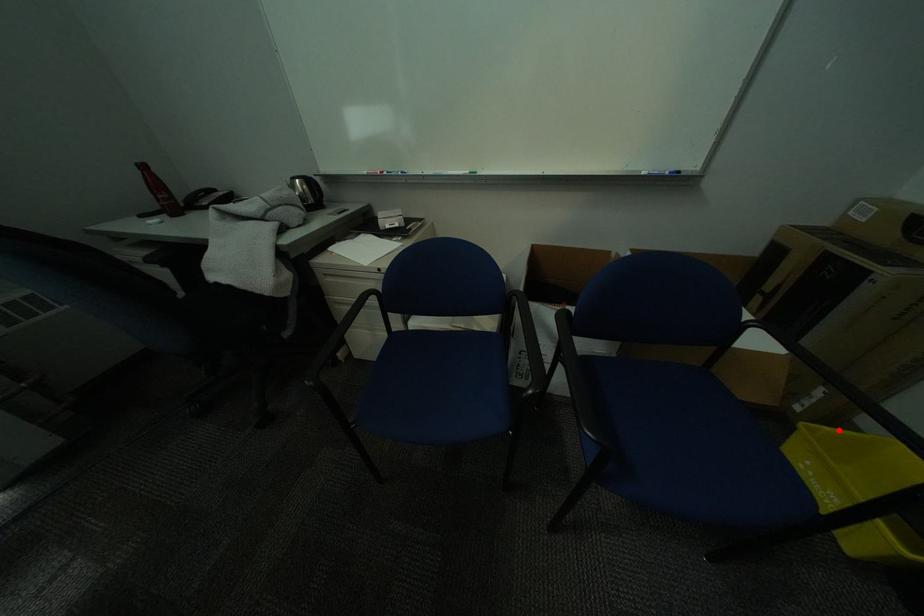
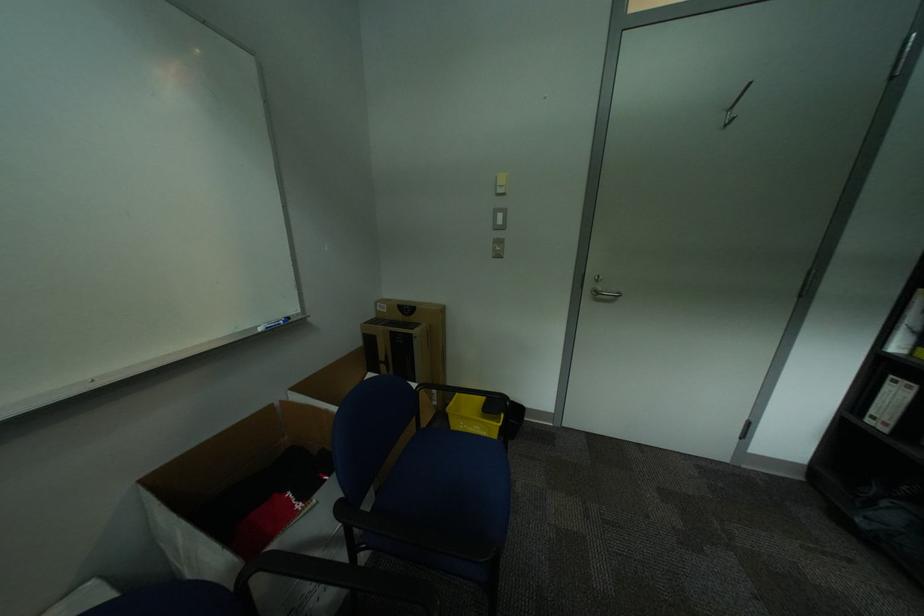
Locate, in the second image, the point that corresponds to the highlighted location in the first image.

(463, 405)